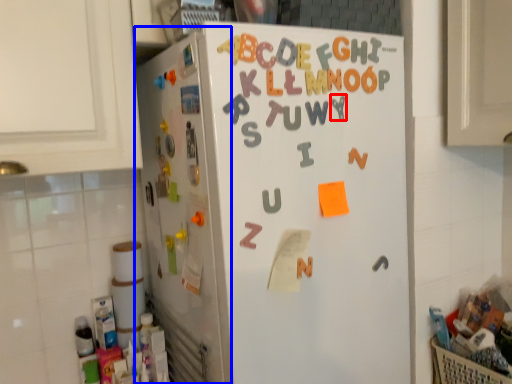
Question: Which object is closer to the camera taking this photo, letter (highlighted by a red box) or appliance (highlighted by a blue box)?

Choices:
 (A) letter
 (B) appliance

Answer: (B)